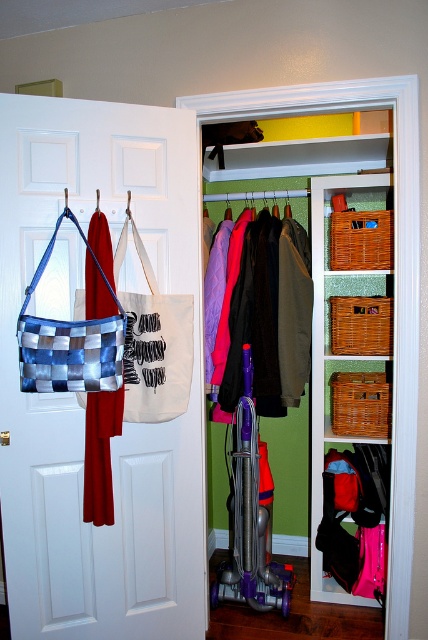
You are moving items in a closet and want to place a new item between the purple plastic vacuum cleaner at center and the red fabric bag at left. Is there enough vertical space between them to fit a 10 cm tall item?

The purple plastic vacuum cleaner at center is below the red fabric bag at left, so there is vertical space between them. Since the item is only 10 cm tall, it should fit between them.

You are organizing items in the closet and need to place a new item between the matte wicker basket at center right and the blue woven bag at left. Is this possible given their positions?

The matte wicker basket at center right is located below the blue woven bag at left, so there is space between them vertically. You can place the new item between them by positioning it either above the basket or below the bag, depending on the available vertical space.